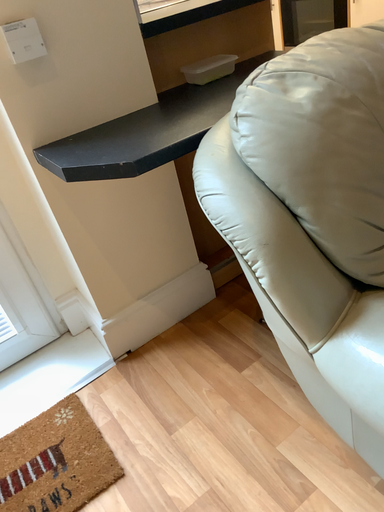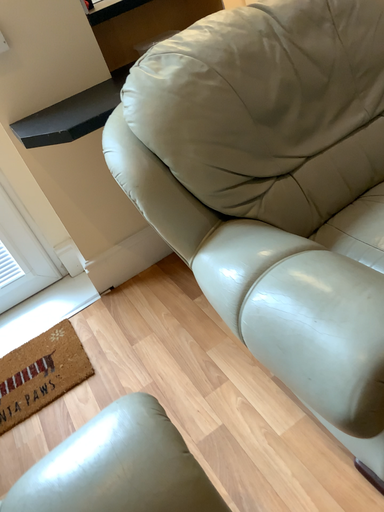
Question: Which way did the camera rotate in the video?

Choices:
 (A) rotated right
 (B) rotated left

Answer: (B)